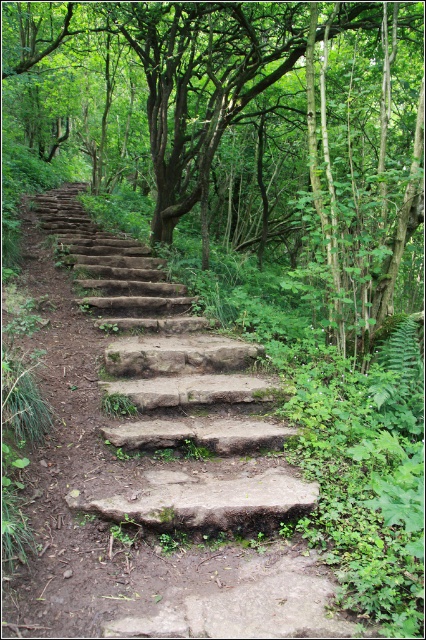
You are a hiker trying to navigate the stone staircase in the forest. You notice the green leafy tree at center and the brown stone stairs at center. Which one is wider?

The green leafy tree at center is wider than the brown stone stairs at center.

You are hiking along the brown stone stairs at center and want to take a photo of the green leafy tree at center. In which direction should you move relative to the stairs to get the tree in your camera view?

You should move to the left of the brown stone stairs at center because the green leafy tree at center is located to the left of the brown stone stairs at center.